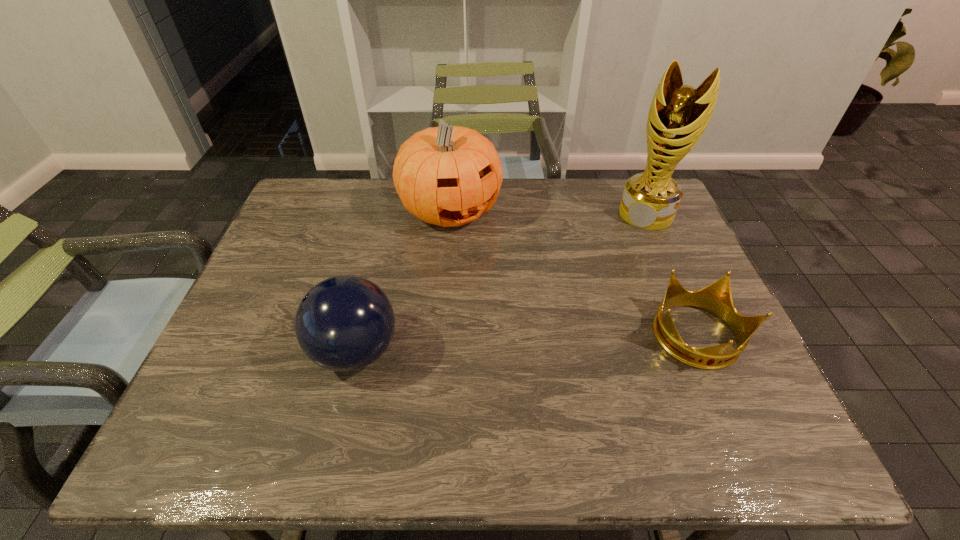
I want to click on vacant spot on the desktop that is between the bowling ball and the crown and is positioned on the front-facing side of the award, so click(x=566, y=343).

Identify the location of vacant space on the desktop that is between the second shortest object and the crown and is positioned on the front-facing side of the pumpkin. (564, 343).